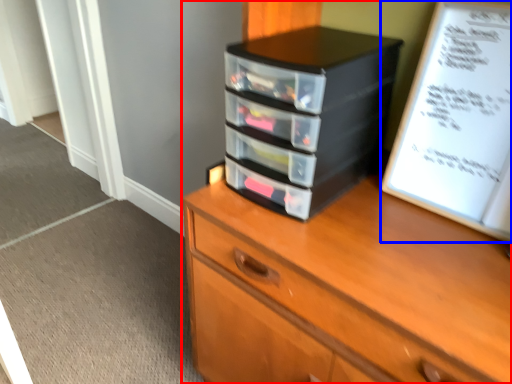
Question: Which point is closer to the camera, chest of drawers (highlighted by a red box) or paperback book (highlighted by a blue box)?

Choices:
 (A) chest of drawers
 (B) paperback book

Answer: (A)